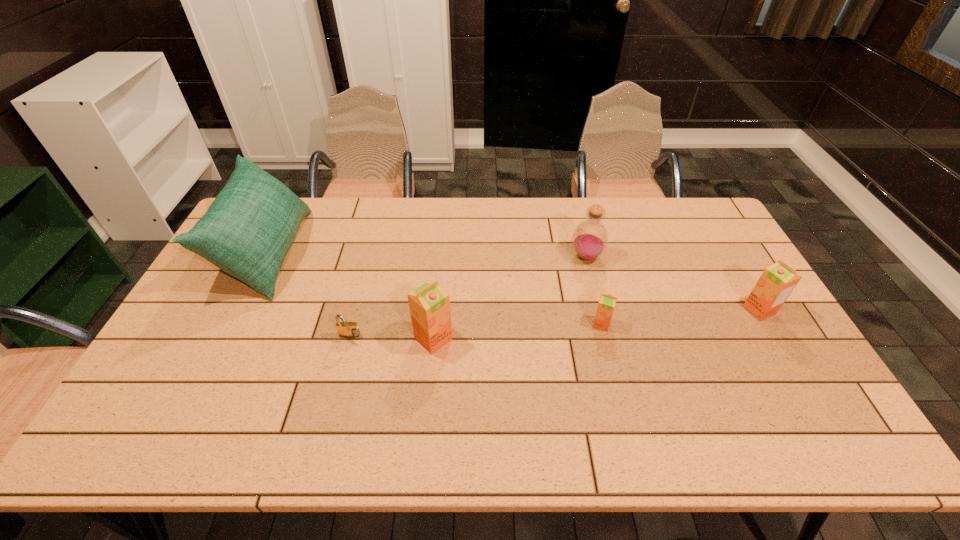
You are a GUI agent. You are given a task and a screenshot of the screen. Output one action in this format:
    pyautogui.click(x=<x>, y=<y>)
    Task: Click on the free space at the far edge of the desktop
    The height and width of the screenshot is (540, 960).
    Given the screenshot: What is the action you would take?
    pyautogui.click(x=622, y=235)

You are a GUI agent. You are given a task and a screenshot of the screen. Output one action in this format:
    pyautogui.click(x=<x>, y=<y>)
    Task: Click on the vacant area at the near edge of the desktop
    This screenshot has height=540, width=960.
    Given the screenshot: What is the action you would take?
    pyautogui.click(x=314, y=388)

The height and width of the screenshot is (540, 960). In the image, there is a desktop. Find the location of `free space at the right edge`. free space at the right edge is located at coordinates (787, 367).

At what (x,y) coordinates should I click in order to perform the action: click on vacant space at the near right corner of the desktop. Please return your answer as a coordinate pair (x, y). Looking at the image, I should click on (758, 378).

I want to click on free point between the fourth object from right to left and the bottle, so click(x=510, y=298).

Identify the location of vacant space in between the bottle and the leftmost orange juice. (510, 298).

Where is `vacant space in between the second shortest object and the bottle`? The image size is (960, 540). vacant space in between the second shortest object and the bottle is located at coordinates (593, 291).

Locate an element on the screen. The image size is (960, 540). free spot between the bottle and the second orange juice from right to left is located at coordinates (593, 291).

Identify the location of unoccupied area between the second shortest orange juice and the second shortest object. This screenshot has width=960, height=540. (681, 317).

I want to click on empty space that is in between the second object from left to right and the bottle, so click(x=468, y=297).